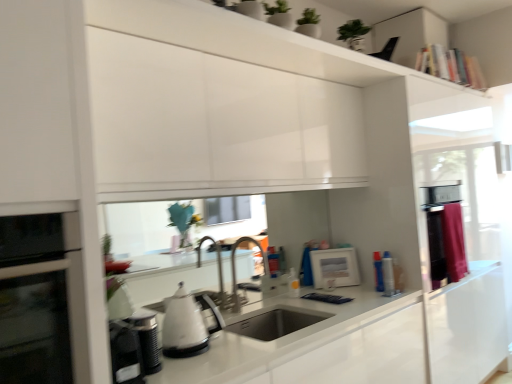
What do you see at coordinates (187, 324) in the screenshot?
I see `white glossy kettle at center` at bounding box center [187, 324].

Locate an element on the screen. Image resolution: width=512 pixels, height=384 pixels. white glossy kettle at lower left, which appears as the fourth appliance when viewed from the right is located at coordinates (125, 354).

The width and height of the screenshot is (512, 384). Find the location of `white glossy picture frame at center, acting as the 2th appliance starting from the right`. white glossy picture frame at center, acting as the 2th appliance starting from the right is located at coordinates (334, 268).

Describe the element at coordinates (334, 268) in the screenshot. I see `white glossy picture frame at center, which ranks as the 1th appliance in back-to-front order` at that location.

I want to click on maroon fabric curtain at right, so click(x=454, y=241).

Which object is wider, silver metallic canister at right, the 2th appliance viewed from the back, or satin nickel faucet at center?

Wider between the two is satin nickel faucet at center.

Does silver metallic canister at right, the 3th appliance from the front, appear on the right side of satin nickel faucet at center?

Indeed, silver metallic canister at right, the 3th appliance from the front, is positioned on the right side of satin nickel faucet at center.

Is silver metallic canister at right, which is counted as the fourth appliance, starting from the left, facing towards satin nickel faucet at center?

No, silver metallic canister at right, which is counted as the fourth appliance, starting from the left, is not turned towards satin nickel faucet at center.

Do you think silver metallic canister at right, the 3th appliance from the front, is within satin nickel faucet at center, or outside of it?

silver metallic canister at right, the 3th appliance from the front, exists outside the volume of satin nickel faucet at center.

From a real-world perspective, is white glossy kettle at lower center, which appears as the 3th appliance when viewed from the right, under maroon fabric curtain at right?

Yes, from a real-world perspective, white glossy kettle at lower center, which appears as the 3th appliance when viewed from the right, is under maroon fabric curtain at right.

Considering the relative sizes of white glossy kettle at lower center, which appears as the 3th appliance when viewed from the right, and maroon fabric curtain at right in the image provided, is white glossy kettle at lower center, which appears as the 3th appliance when viewed from the right, smaller than maroon fabric curtain at right?

Correct, white glossy kettle at lower center, which appears as the 3th appliance when viewed from the right, occupies less space than maroon fabric curtain at right.

Would you consider white glossy kettle at lower center, acting as the second appliance starting from the left, to be distant from maroon fabric curtain at right?

Absolutely, white glossy kettle at lower center, acting as the second appliance starting from the left, is distant from maroon fabric curtain at right.

Which of these two, white glossy kettle at lower center, acting as the second appliance starting from the left, or maroon fabric curtain at right, stands taller?

maroon fabric curtain at right is taller.

Considering the sizes of black glass oven at left and maroon fabric curtain at right in the image, is black glass oven at left bigger or smaller than maroon fabric curtain at right?

Considering their sizes, black glass oven at left takes up more space than maroon fabric curtain at right.

Can you confirm if black glass oven at left is positioned to the left of maroon fabric curtain at right?

Correct, you'll find black glass oven at left to the left of maroon fabric curtain at right.

From the image's perspective, which is above, black glass oven at left or maroon fabric curtain at right?

maroon fabric curtain at right is shown above in the image.

Does black glass oven at left have a lesser width compared to maroon fabric curtain at right?

No, black glass oven at left is not thinner than maroon fabric curtain at right.

In terms of height, does white glossy picture frame at center, placed as the 3th appliance when sorted from left to right, look taller or shorter compared to white glossy kettle at lower left, the first appliance in the front-to-back sequence?

white glossy picture frame at center, placed as the 3th appliance when sorted from left to right, is taller than white glossy kettle at lower left, the first appliance in the front-to-back sequence.

You are a GUI agent. You are given a task and a screenshot of the screen. Output one action in this format:
    pyautogui.click(x=<x>, y=<y>)
    Task: Click on the appliance that is the 2nd one below the white glossy picture frame at center, acting as the 2th appliance starting from the right (from a real-world perspective)
    The width and height of the screenshot is (512, 384).
    Given the screenshot: What is the action you would take?
    pyautogui.click(x=125, y=354)

Is there a large distance between white glossy picture frame at center, placed as the 3th appliance when sorted from left to right, and white glossy kettle at lower left, which appears as the fourth appliance when viewed from the right?

white glossy picture frame at center, placed as the 3th appliance when sorted from left to right, is positioned a significant distance from white glossy kettle at lower left, which appears as the fourth appliance when viewed from the right.

From the picture: Would you say maroon fabric curtain at right is part of white glossy kettle at center's contents?

No.

Considering the sizes of objects white glossy kettle at center and maroon fabric curtain at right in the image provided, who is bigger, white glossy kettle at center or maroon fabric curtain at right?

Bigger between the two is maroon fabric curtain at right.

From a real-world perspective, relative to maroon fabric curtain at right, is white glossy kettle at center vertically above or below?

white glossy kettle at center is situated lower than maroon fabric curtain at right in the real world.

In the image, is white glossy kettle at lower left, which appears as the fourth appliance when viewed from the right, positioned in front of or behind black glass oven at left?

white glossy kettle at lower left, which appears as the fourth appliance when viewed from the right, is positioned farther from the viewer than black glass oven at left.

From the image's perspective, between white glossy kettle at lower left, which appears as the 4th appliance when viewed from the back, and black glass oven at left, who is located below?

white glossy kettle at lower left, which appears as the 4th appliance when viewed from the back, appears lower in the image.

Is white glossy kettle at lower left, which appears as the 4th appliance when viewed from the back, to the left of black glass oven at left from the viewer's perspective?

No.

Between white glossy kettle at lower left, which appears as the 4th appliance when viewed from the back, and black glass oven at left, which one has less height?

white glossy kettle at lower left, which appears as the 4th appliance when viewed from the back.

From a real-world perspective, which is physically above, black glass oven at left or satin nickel faucet at center?

black glass oven at left, from a real-world perspective.

From the image's perspective, is black glass oven at left above or below satin nickel faucet at center?

black glass oven at left is above satin nickel faucet at center.

Is black glass oven at left aimed at satin nickel faucet at center?

No, black glass oven at left is not oriented towards satin nickel faucet at center.

Which object is closer to the camera taking this photo, black glass oven at left or satin nickel faucet at center?

black glass oven at left.

I want to click on faucet to the left of silver metallic canister at right, which is counted as the fourth appliance, starting from the left, so click(x=236, y=271).

In order to click on curtain that appears on the right of white glossy kettle at lower center, which appears as the third appliance when viewed from the back in this screenshot , I will do `click(454, 241)`.

Looking at the image, which one is located further to black glass oven at left, white glossy kettle at lower left, the first appliance in the front-to-back sequence, or maroon fabric curtain at right?

maroon fabric curtain at right is further to black glass oven at left.

From the image, which object appears to be farther from white glossy kettle at lower center, arranged as the second appliance when viewed from the front, white glossy kettle at center or maroon fabric curtain at right?

Among the two, maroon fabric curtain at right is located further to white glossy kettle at lower center, arranged as the second appliance when viewed from the front.

Considering their positions, is white glossy picture frame at center, which ranks as the 1th appliance in back-to-front order, positioned further to maroon fabric curtain at right than white glossy kettle at center?

white glossy kettle at center.

Considering their positions, is maroon fabric curtain at right positioned closer to silver metallic canister at right, acting as the first appliance starting from the right, than white glossy kettle at lower left, the first appliance in the front-to-back sequence?

maroon fabric curtain at right lies closer to silver metallic canister at right, acting as the first appliance starting from the right, than the other object.

Looking at the image, which one is located closer to white glossy picture frame at center, placed as the 3th appliance when sorted from left to right, white glossy kettle at lower left, which appears as the 4th appliance when viewed from the back, or maroon fabric curtain at right?

The object closer to white glossy picture frame at center, placed as the 3th appliance when sorted from left to right, is maroon fabric curtain at right.

Estimate the real-world distances between objects in this image. Which object is further from white glossy kettle at lower left, the first appliance in the front-to-back sequence, satin nickel faucet at center or white glossy kettle at lower center, acting as the second appliance starting from the left?

satin nickel faucet at center.

Based on their spatial positions, is white glossy kettle at lower center, which appears as the 3th appliance when viewed from the right, or white glossy kettle at lower left, which appears as the 4th appliance when viewed from the back, further from silver metallic canister at right, which is counted as the fourth appliance, starting from the left?

The object further to silver metallic canister at right, which is counted as the fourth appliance, starting from the left, is white glossy kettle at lower left, which appears as the 4th appliance when viewed from the back.

Looking at this image, from the image, which object appears to be nearer to white glossy kettle at lower center, which appears as the third appliance when viewed from the back, white glossy kettle at lower left, which appears as the fourth appliance when viewed from the right, or white glossy kettle at center?

white glossy kettle at lower left, which appears as the fourth appliance when viewed from the right, is closer to white glossy kettle at lower center, which appears as the third appliance when viewed from the back.

Where is `kitchen appliance between black glass oven at left and satin nickel faucet at center in the front-back direction`? The image size is (512, 384). kitchen appliance between black glass oven at left and satin nickel faucet at center in the front-back direction is located at coordinates (187, 324).

Where is `kitchen appliance between black glass oven at left and white glossy picture frame at center, which is counted as the 4th appliance, starting from the front, in the front-back direction`? Image resolution: width=512 pixels, height=384 pixels. kitchen appliance between black glass oven at left and white glossy picture frame at center, which is counted as the 4th appliance, starting from the front, in the front-back direction is located at coordinates (187, 324).

The width and height of the screenshot is (512, 384). I want to click on kitchen appliance between white glossy kettle at lower left, the first appliance in the front-to-back sequence, and silver metallic canister at right, which is counted as the fourth appliance, starting from the left, so click(187, 324).

In order to click on faucet between white glossy kettle at lower center, acting as the second appliance starting from the left, and white glossy picture frame at center, which ranks as the 1th appliance in back-to-front order, along the z-axis in this screenshot , I will do `click(236, 271)`.